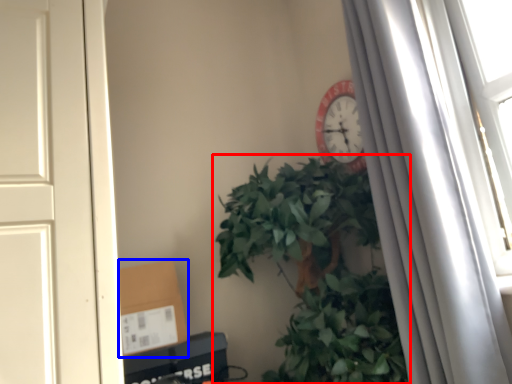
Question: Which object is further to the camera taking this photo, houseplant (highlighted by a red box) or cardboard box (highlighted by a blue box)?

Choices:
 (A) houseplant
 (B) cardboard box

Answer: (B)